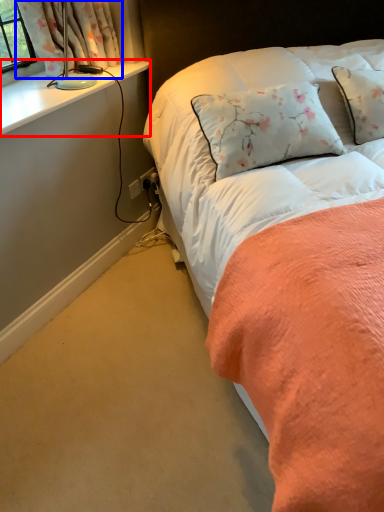
Question: Which point is further to the camera, window sill (highlighted by a red box) or curtain (highlighted by a blue box)?

Choices:
 (A) window sill
 (B) curtain

Answer: (B)